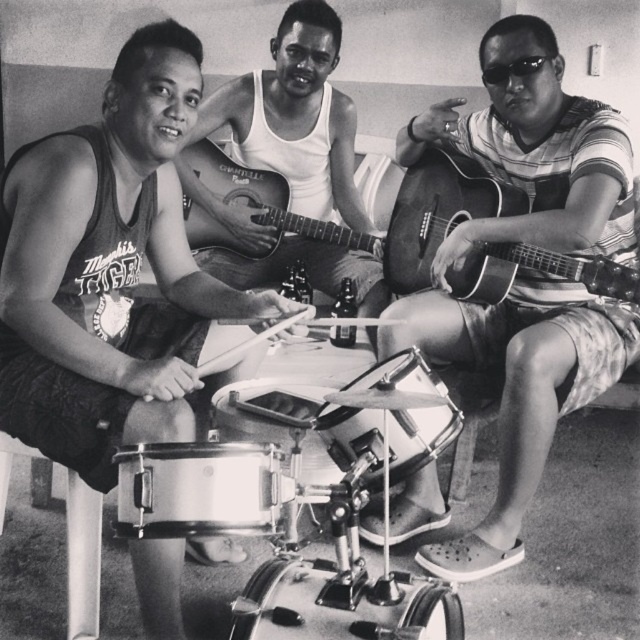
You are a photographer standing at the center of the room. You want to take a closeup shot of the metallic drum at lower left without moving any objects. Can you step forward to get closer to the drum?

The metallic drum at lower left and viewer are 5.28 feet apart from each other, so stepping forward would reduce the distance, allowing for a closer shot as long as there is enough space to move forward without obstruction.

You are setting up a music room and need to place the metallic silver drum at center and the shiny silver drum at center on a shelf. The shelf has a height limit of 10 cm. Can both drums fit vertically on the shelf without exceeding the height limit?

The metallic silver drum at center is shorter than the shiny silver drum at center. Since the shelf has a height limit of 10 cm, we need to know the exact height of the taller drum. However, since the description only states that the metallic silver drum is shorter, it might still fit if the shiny silver drum is under 10 cm. But without specific measurements, we can only confirm the metallic silver drum will fit if the shiny one is also within the limit. However, the problem states the shelf has a height of

You are a photographer adjusting your camera settings to focus on the metallic drum at lower left and the shiny silver drum at center. Which drum should you focus on first if you want to capture both in sharp detail?

You should focus on the metallic drum at lower left first because it is closer to you than the shiny silver drum at center, ensuring both are in focus when using depth of field techniques.